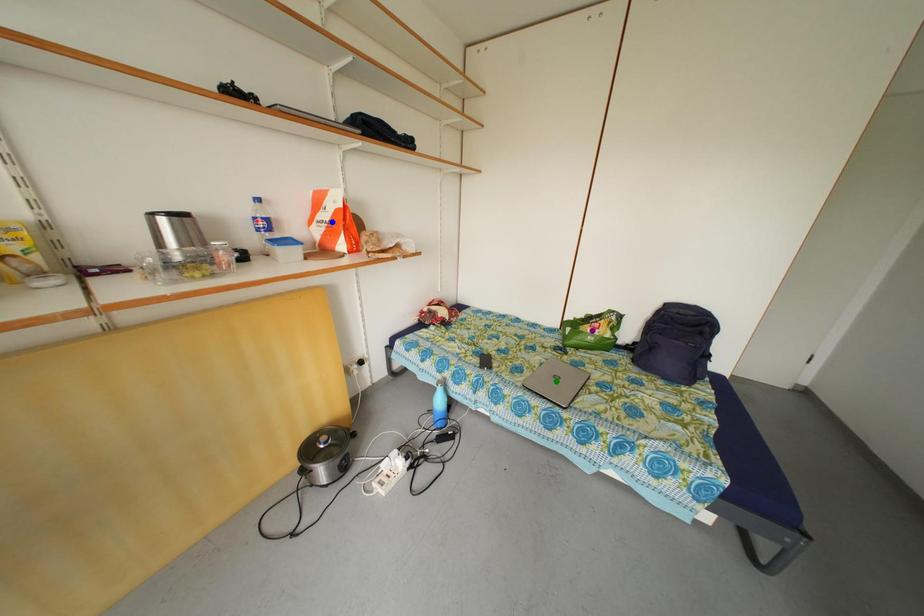
Order these from farthest to nearest:
green point
purple point
blue point

purple point < green point < blue point